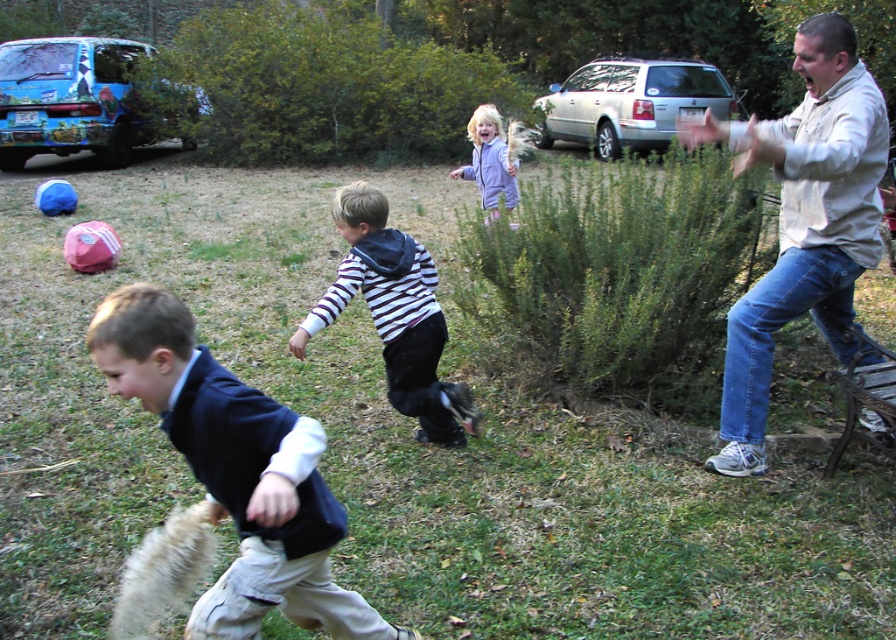
You are a photographer trying to capture a photo of the striped hoodie at center and the purple fleece jacket at upper center. Based on their positions, which clothing item should you focus on first to ensure both are in frame?

The striped hoodie at center is taller than the purple fleece jacket at upper center, so you should focus on the striped hoodie at center first to ensure both are in frame.

You are standing at the center of the image and see a point marked at coordinates (802, 221). Based on the scene description, which object is this point located on?

The point at coordinates (802, 221) is located on the beige cotton shirt at right.